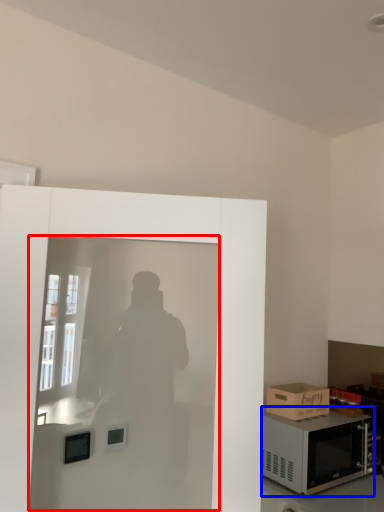
Question: Which point is closer to the camera, screen door (highlighted by a red box) or microwave oven (highlighted by a blue box)?

Choices:
 (A) screen door
 (B) microwave oven

Answer: (A)